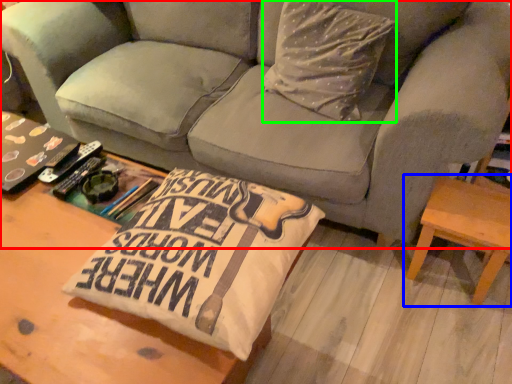
Question: Which is farther away from studio couch (highlighted by a red box)? table (highlighted by a blue box) or throw pillow (highlighted by a green box)?

Choices:
 (A) table
 (B) throw pillow

Answer: (A)